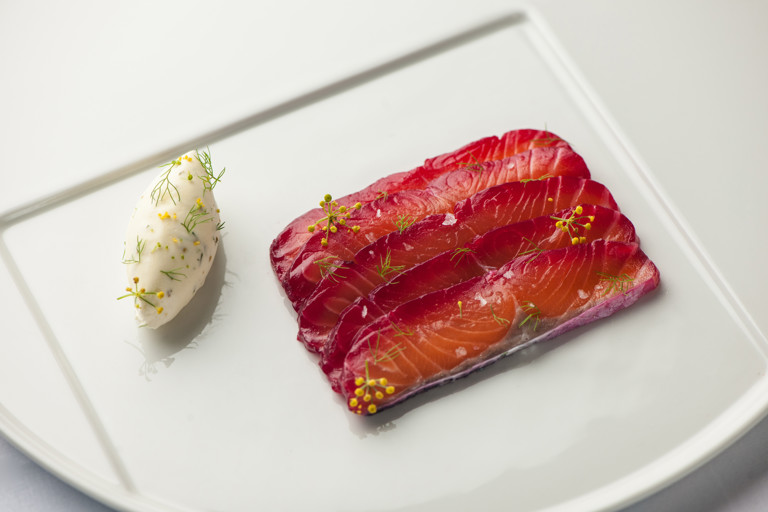
Where is `white tray`? white tray is located at coordinates (727, 133).